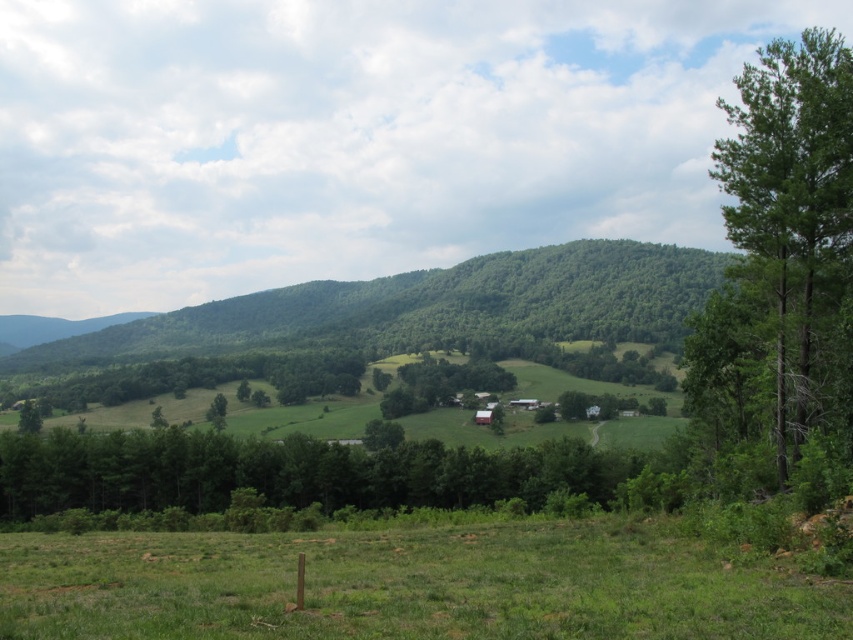
Question: Which of the following is the farthest from the observer?

Choices:
 (A) (747, 400)
 (B) (218, 440)
 (C) (392, 621)
 (D) (422, 288)

Answer: (D)

Question: Can you confirm if green grassy field at lower center is positioned below green leafy tree at center?

Choices:
 (A) no
 (B) yes

Answer: (A)

Question: Does green leafy mountain at center come in front of green matte tree at center?

Choices:
 (A) yes
 (B) no

Answer: (B)

Question: Which of the following is the farthest from the observer?

Choices:
 (A) green grassy field at lower center
 (B) green leafy tree at center
 (C) green leafy tree at right
 (D) green leafy mountain at center

Answer: (D)

Question: Does green leafy tree at center appear on the left side of green matte tree at center?

Choices:
 (A) no
 (B) yes

Answer: (B)

Question: Which object appears closest to the camera in this image?

Choices:
 (A) green matte tree at center
 (B) green leafy tree at center

Answer: (B)